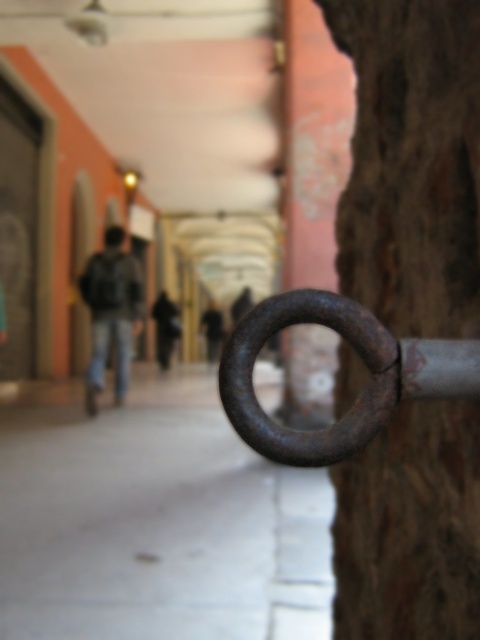
You are a painter standing in the corridor and want to hang a canvas that is 1.2 meters tall on the rusty metal ring at right. Considering the height of the dark gray hoodie at center, which is worn by a person of average height, will the canvas fit properly?

The rusty metal ring at right is not as tall as the dark gray hoodie at center. Since the hoodie is worn by a person of average height, the ring is likely positioned at a height that is lower than typical hanging height for a 1.2 meter canvas. The canvas may hang too low, so it might not fit properly.

You are standing in the corridor and see two points marked on the wall. The first point is at coordinates point (453, 365) and the second is at point (157, 307). Which point is closer to you?

Point (453, 365) is closer to the viewer than point (157, 307).

You are standing in a corridor with a high orange ceiling. You see a rusty metal ring at right and a dark gray hoodie at center. Which object is closer to you?

The rusty metal ring at right is closer to you because it is in front of the dark gray hoodie at center.